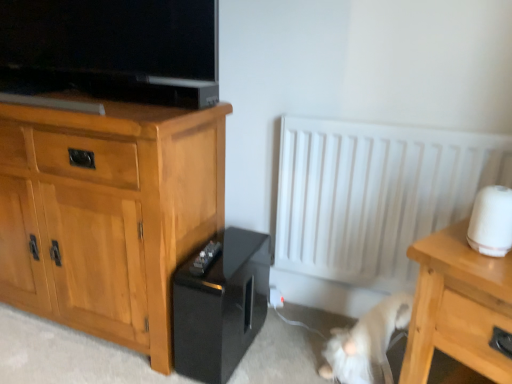
Question: From a real-world perspective, is light wood cabinet at left located beneath white fur cat at lower right?

Choices:
 (A) yes
 (B) no

Answer: (B)

Question: Is light wood cabinet at left shorter than white fur cat at lower right?

Choices:
 (A) no
 (B) yes

Answer: (A)

Question: Is light wood cabinet at left thinner than white fur cat at lower right?

Choices:
 (A) yes
 (B) no

Answer: (B)

Question: Is light wood cabinet at left at the right side of white fur cat at lower right?

Choices:
 (A) yes
 (B) no

Answer: (B)

Question: Does light wood cabinet at left have a smaller size compared to white fur cat at lower right?

Choices:
 (A) no
 (B) yes

Answer: (A)

Question: Is light wood cabinet at left in front of or behind white fur cat at lower right in the image?

Choices:
 (A) behind
 (B) front

Answer: (B)

Question: Considering the positions of light wood cabinet at left and white fur cat at lower right in the image, is light wood cabinet at left taller or shorter than white fur cat at lower right?

Choices:
 (A) tall
 (B) short

Answer: (A)

Question: Considering the positions of point (32, 284) and point (326, 352), is point (32, 284) closer or farther from the camera than point (326, 352)?

Choices:
 (A) closer
 (B) farther

Answer: (B)

Question: Is light wood cabinet at left inside or outside of white fur cat at lower right?

Choices:
 (A) outside
 (B) inside

Answer: (A)

Question: In the image, is light wood/texture nightstand at lower right on the left side or the right side of white matte radiator at center?

Choices:
 (A) left
 (B) right

Answer: (B)

Question: Is light wood/texture nightstand at lower right wider or thinner than white matte radiator at center?

Choices:
 (A) thin
 (B) wide

Answer: (B)

Question: From a real-world perspective, is light wood/texture nightstand at lower right physically located above or below white matte radiator at center?

Choices:
 (A) above
 (B) below

Answer: (B)

Question: Does point (504, 269) appear closer or farther from the camera than point (381, 216)?

Choices:
 (A) farther
 (B) closer

Answer: (B)

Question: Is point (27, 208) closer or farther from the camera than point (297, 296)?

Choices:
 (A) farther
 (B) closer

Answer: (B)

Question: Is light wood cabinet at left to the left or to the right of white matte radiator at center in the image?

Choices:
 (A) left
 (B) right

Answer: (A)